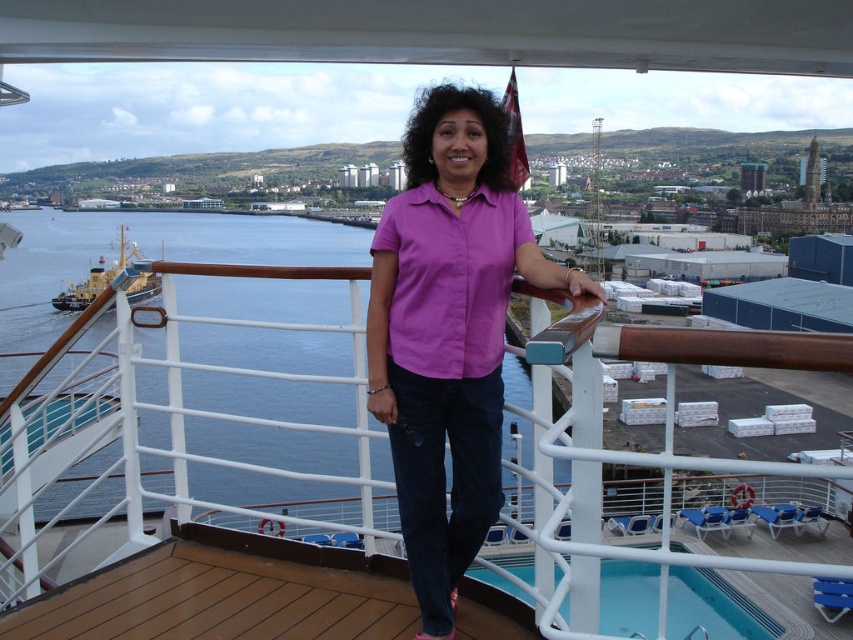
You are standing on the cruise ship deck and want to take a photo of the yellow painted steel ship at left without the matte pink shirt at center blocking the view. Where should you move to achieve this?

The matte pink shirt at center is in front of the yellow painted steel ship at left, so you should move to the side or behind the matte pink shirt at center to ensure the yellow painted steel ship at left is visible without obstruction.

Where is the matte pink shirt at center located in the image?

The matte pink shirt at center is located at point coordinates of approximately 0.519 on the x axis and 0.526 on the y axis.